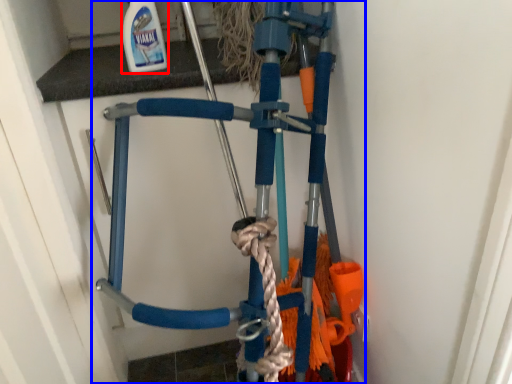
Question: Which object appears closest to the camera in this image, cleaning product (highlighted by a red box) or bicycle (highlighted by a blue box)?

Choices:
 (A) cleaning product
 (B) bicycle

Answer: (A)